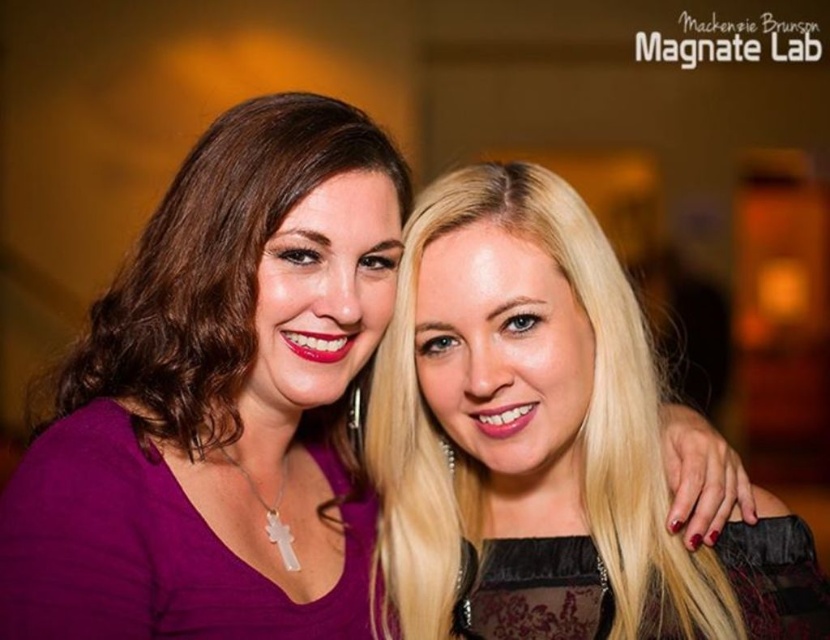
Question: Which object is farther from the camera taking this photo?

Choices:
 (A) blonde hair at right
 (B) matte purple blouse at left

Answer: (A)

Question: Is blonde hair at right to the right of matte purple blouse at left from the viewer's perspective?

Choices:
 (A) no
 (B) yes

Answer: (B)

Question: In this image, where is blonde hair at right located relative to matte purple blouse at left?

Choices:
 (A) left
 (B) right

Answer: (B)

Question: Which object is farther from the camera taking this photo?

Choices:
 (A) blonde hair at right
 (B) matte purple blouse at left

Answer: (A)

Question: Which object appears closest to the camera in this image?

Choices:
 (A) blonde hair at right
 (B) matte purple blouse at left

Answer: (B)

Question: Can you confirm if blonde hair at right is positioned to the right of matte purple blouse at left?

Choices:
 (A) yes
 (B) no

Answer: (A)